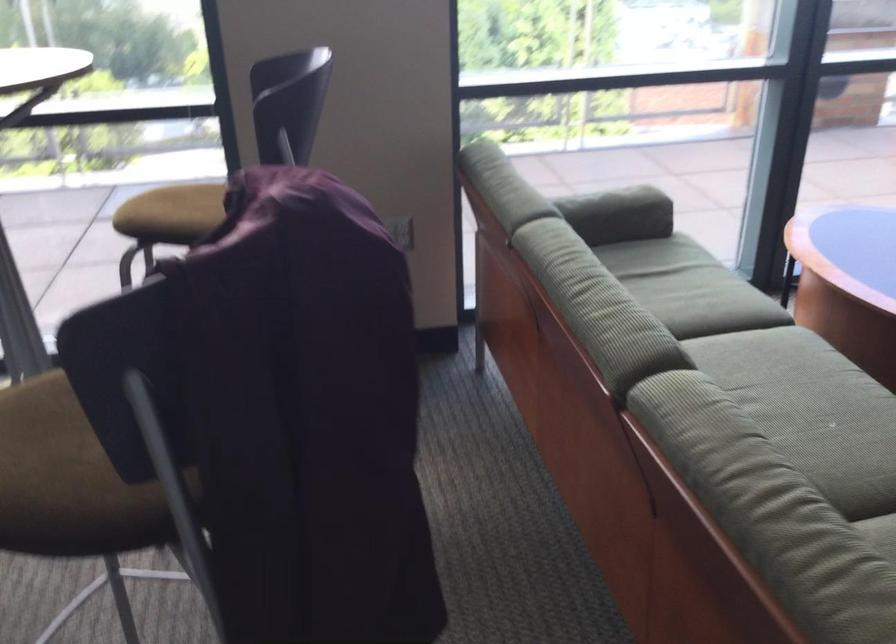
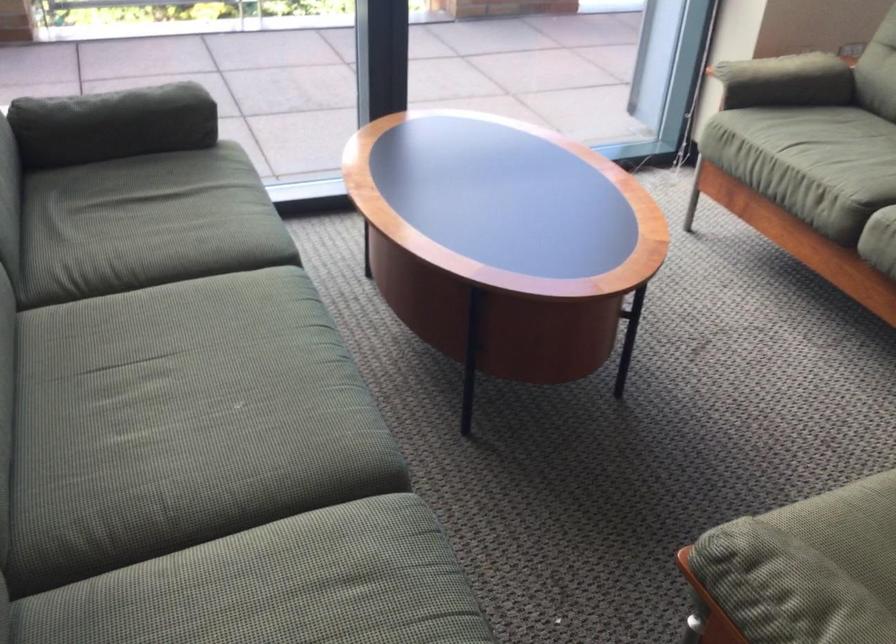
Which direction would the cameraman need to move to produce the second image?

The cameraman walked toward right, forward.